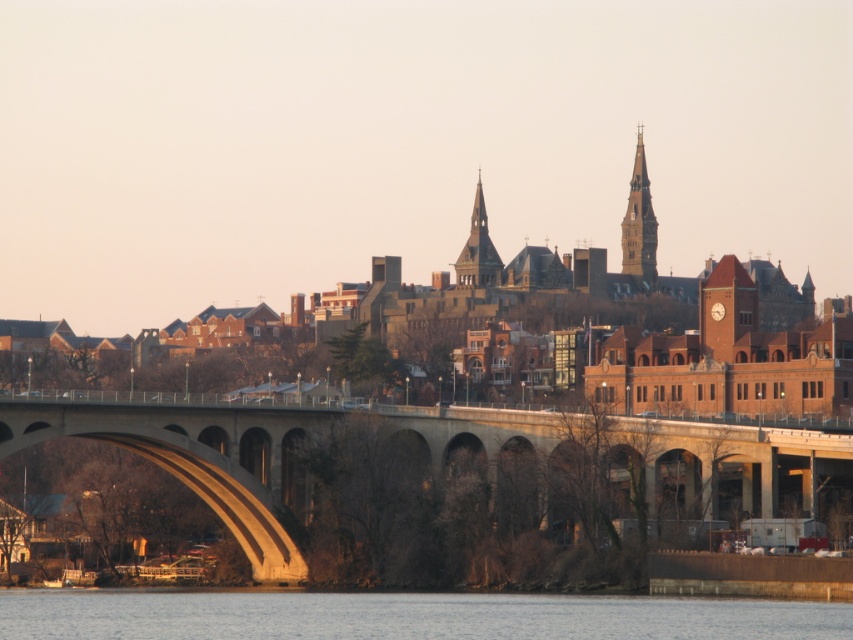
Is concrete bridge at center smaller than smooth gray stone spire at upper right?

Incorrect, concrete bridge at center is not smaller in size than smooth gray stone spire at upper right.

Does concrete bridge at center appear over smooth gray stone spire at upper right?

No.

Image resolution: width=853 pixels, height=640 pixels. Find the location of `concrete bridge at center`. concrete bridge at center is located at coordinates (426, 454).

Which is more to the right, smooth water at lower center or smooth gray spire at center?

From the viewer's perspective, smooth gray spire at center appears more on the right side.

Is smooth water at lower center to the left of smooth gray spire at center from the viewer's perspective?

Correct, you'll find smooth water at lower center to the left of smooth gray spire at center.

At what (x,y) coordinates should I click in order to perform the action: click on smooth water at lower center. Please return your answer as a coordinate pair (x, y). Looking at the image, I should click on (404, 616).

Locate an element on the screen. The image size is (853, 640). smooth water at lower center is located at coordinates (404, 616).

Measure the distance from concrete bridge at center to smooth gray spire at center.

The distance of concrete bridge at center from smooth gray spire at center is 130.62 meters.

Who is higher up, concrete bridge at center or smooth gray spire at center?

Positioned higher is smooth gray spire at center.

Find the location of a particular element. The height and width of the screenshot is (640, 853). concrete bridge at center is located at coordinates (426, 454).